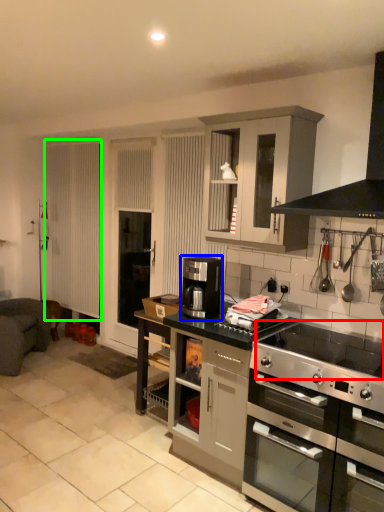
Question: Which is farther away from gas stove (highlighted by a red box)? coffee machine (highlighted by a blue box) or screen door (highlighted by a green box)?

Choices:
 (A) coffee machine
 (B) screen door

Answer: (B)